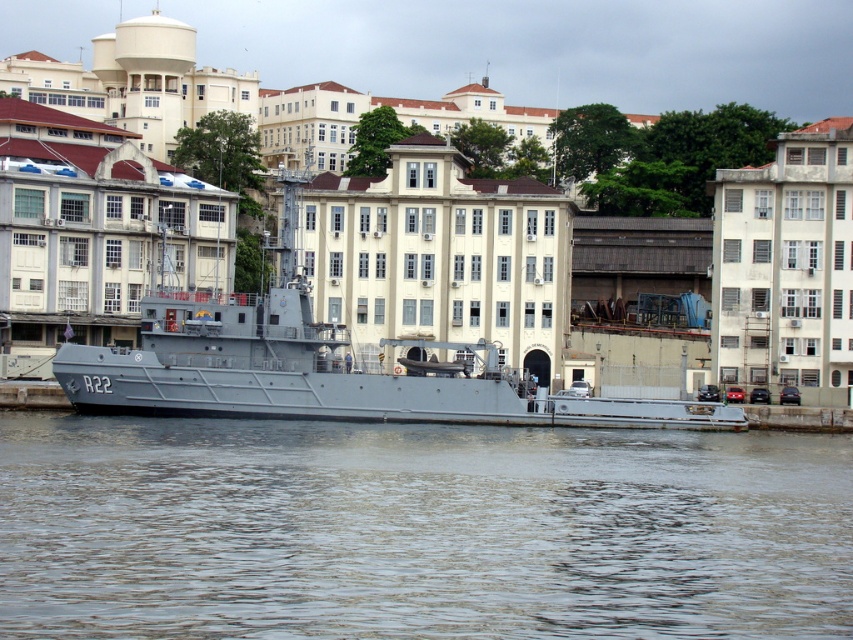
Question: Is gray water at center closer to camera compared to gray matte boat at center?

Choices:
 (A) yes
 (B) no

Answer: (A)

Question: Which point is closer to the camera taking this photo?

Choices:
 (A) (344, 404)
 (B) (70, 458)

Answer: (B)

Question: Does gray water at center come in front of gray matte boat at center?

Choices:
 (A) yes
 (B) no

Answer: (A)

Question: Is gray water at center smaller than gray matte boat at center?

Choices:
 (A) no
 (B) yes

Answer: (B)